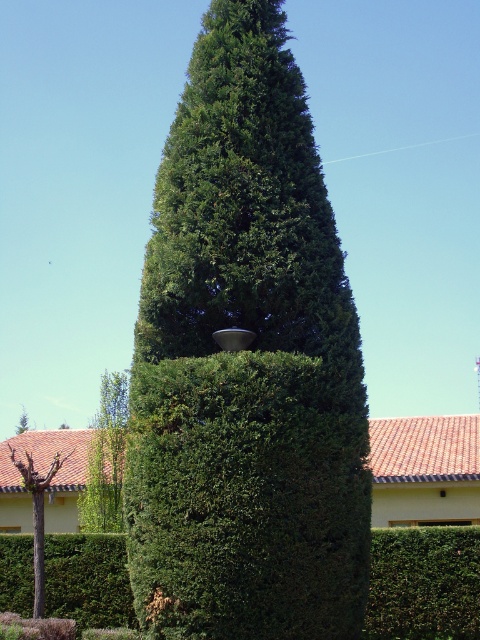
Is green leafy bush at lower left to the left of green leafy tree at lower left from the viewer's perspective?

Incorrect, green leafy bush at lower left is not on the left side of green leafy tree at lower left.

Which is behind, point (59, 538) or point (115, 380)?

The point (115, 380) is more distant.

Locate an element on the screen. The image size is (480, 640). green leafy bush at lower left is located at coordinates (87, 579).

This screenshot has height=640, width=480. Identify the location of green leafy bush at lower left. (87, 579).

Is green leafy shrub at lower right bigger than brown bark tree at lower left?

No, green leafy shrub at lower right is not bigger than brown bark tree at lower left.

In the scene shown: Can you confirm if green leafy shrub at lower right is taller than brown bark tree at lower left?

Incorrect, green leafy shrub at lower right's height is not larger of brown bark tree at lower left's.

Is point (409, 532) farther from viewer compared to point (38, 508)?

That is True.

The height and width of the screenshot is (640, 480). Identify the location of green leafy shrub at lower right. (423, 582).

Can you confirm if green leafy tree at center is taller than green leafy shrub at lower right?

Incorrect, green leafy tree at center's height is not larger of green leafy shrub at lower right's.

Locate an element on the screen. The image size is (480, 640). green leafy tree at center is located at coordinates (245, 364).

Find the location of `green leafy tree at center`. green leafy tree at center is located at coordinates (245, 364).